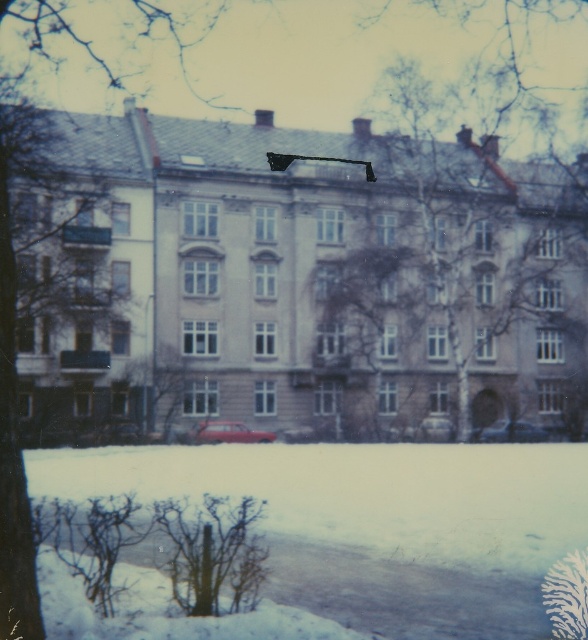
You are standing in front of the residential building and want to determine the spatial relationship between two points marked in the image. Which point, point (340, 580) or point (335, 413), is closer to you?

Point (340, 580) is closer to the viewer than point (335, 413).

You are standing at the point marked as point (375,522) in the winter scene. What is the material you are standing on?

The point (375,522) corresponds to white powdery snow at lower center, so you are standing on snow.

You are standing at the viewpoint of the image and want to reach the point marked as point (228, 422). If your walking speed is 1.2 meters per second, how many seconds will it take you to reach that point?

The distance between you and point (228, 422) is 72.64 meters. At a walking speed of 1.2 meters per second, it will take 72.64 divided by 1.2, which equals approximately 60.53 seconds to reach the point.